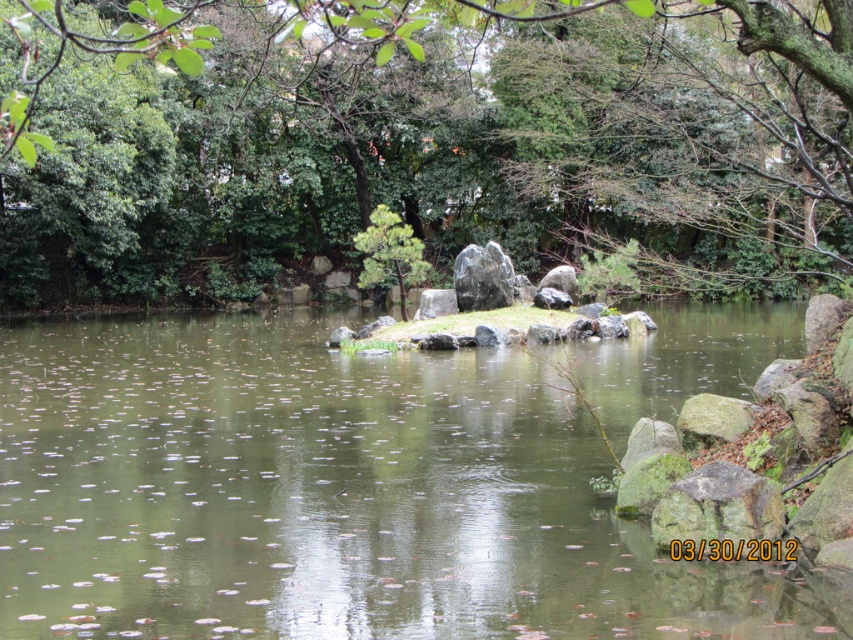
Is rough textured rock at lower right taller than gray rock at center?

No, rough textured rock at lower right is not taller than gray rock at center.

Based on the photo, is rough textured rock at lower right wider than gray rock at center?

In fact, rough textured rock at lower right might be narrower than gray rock at center.

Who is more forward, (695,531) or (436,291)?

Point (695,531) is more forward.

The width and height of the screenshot is (853, 640). Identify the location of rough textured rock at lower right. (718, 506).

Is point (671, 509) farther from viewer compared to point (408, 269)?

No, (671, 509) is closer to viewer.

Between point (679, 486) and point (381, 276), which one is positioned in front?

Positioned in front is point (679, 486).

The image size is (853, 640). I want to click on rough textured rock at lower right, so click(x=718, y=506).

Who is positioned more to the right, green stone island at center or gray polished rock at center?

gray polished rock at center is more to the right.

Between green stone island at center and gray polished rock at center, which one is positioned lower?

green stone island at center is below.

Is point (674, 349) positioned behind point (492, 250)?

No, (674, 349) is closer to viewer.

Where is `green stone island at center`? green stone island at center is located at coordinates (357, 484).